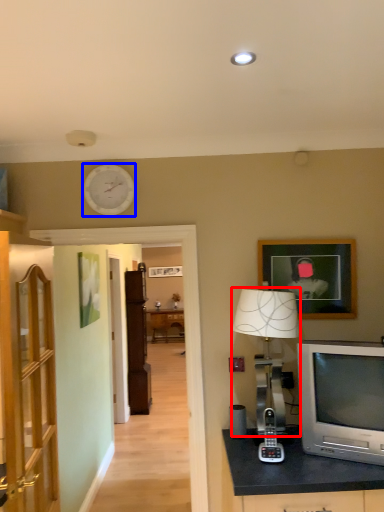
Question: Which of the following is the closest to the observer, table lamp (highlighted by a red box) or clock (highlighted by a blue box)?

Choices:
 (A) table lamp
 (B) clock

Answer: (A)